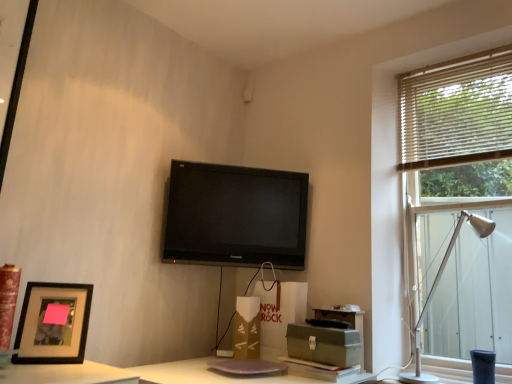
Question: Does matte white speaker at upper center have a lesser width compared to silver metallic table lamp at right?

Choices:
 (A) yes
 (B) no

Answer: (A)

Question: Is matte white speaker at upper center not inside silver metallic table lamp at right?

Choices:
 (A) yes
 (B) no

Answer: (A)

Question: From the image's perspective, does matte white speaker at upper center appear lower than silver metallic table lamp at right?

Choices:
 (A) yes
 (B) no

Answer: (B)

Question: Considering the relative sizes of matte white speaker at upper center and silver metallic table lamp at right in the image provided, is matte white speaker at upper center smaller than silver metallic table lamp at right?

Choices:
 (A) yes
 (B) no

Answer: (A)

Question: Is matte white speaker at upper center further to camera compared to silver metallic table lamp at right?

Choices:
 (A) no
 (B) yes

Answer: (B)

Question: Is matte white speaker at upper center wider or thinner than matte brown cardboard box at center, the second cardboard box positioned from the right?

Choices:
 (A) thin
 (B) wide

Answer: (A)

Question: Based on their sizes in the image, would you say matte white speaker at upper center is bigger or smaller than matte brown cardboard box at center, the second cardboard box positioned from the right?

Choices:
 (A) small
 (B) big

Answer: (A)

Question: From a real-world perspective, relative to matte brown cardboard box at center, the second cardboard box positioned from the right, is matte white speaker at upper center vertically above or below?

Choices:
 (A) above
 (B) below

Answer: (A)

Question: Is matte white speaker at upper center to the left or to the right of matte brown cardboard box at center, the 1th cardboard box viewed from the back, in the image?

Choices:
 (A) right
 (B) left

Answer: (B)

Question: Is silver metallic table lamp at right taller or shorter than wooden blinds at right?

Choices:
 (A) tall
 (B) short

Answer: (B)

Question: In the image, is silver metallic table lamp at right on the left side or the right side of wooden blinds at right?

Choices:
 (A) right
 (B) left

Answer: (B)

Question: In terms of size, does silver metallic table lamp at right appear bigger or smaller than wooden blinds at right?

Choices:
 (A) big
 (B) small

Answer: (B)

Question: From a real-world perspective, is silver metallic table lamp at right physically located above or below wooden blinds at right?

Choices:
 (A) above
 (B) below

Answer: (B)

Question: Is point (47, 296) positioned closer to the camera than point (246, 89)?

Choices:
 (A) farther
 (B) closer

Answer: (B)

Question: In terms of width, does matte black picture frame at lower left look wider or thinner when compared to matte white speaker at upper center?

Choices:
 (A) wide
 (B) thin

Answer: (A)